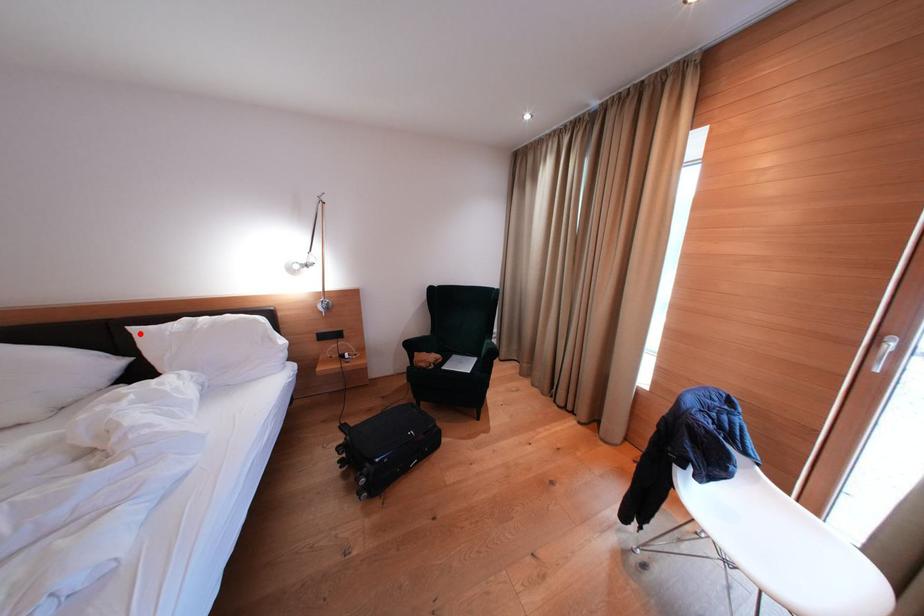
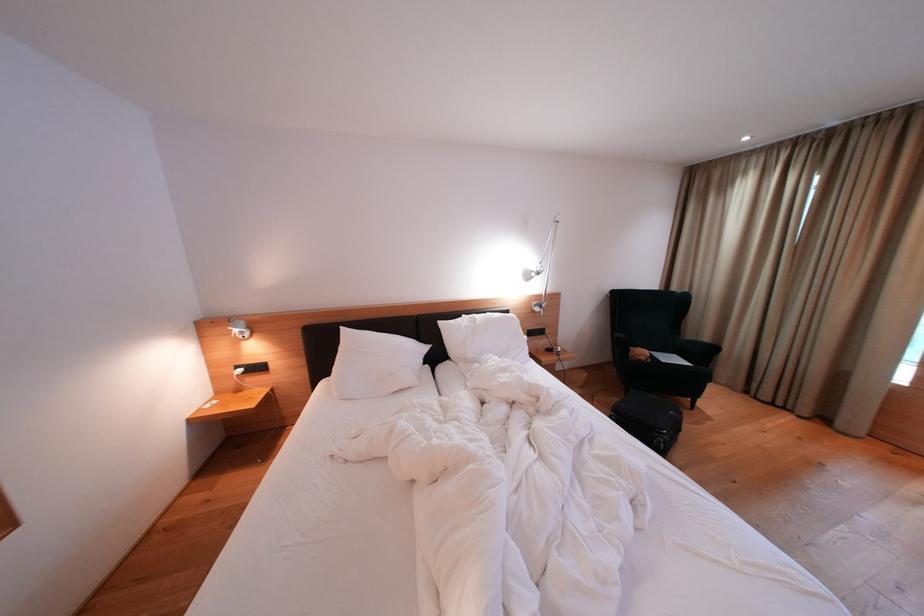
Locate, in the second image, the point that corresponds to the highlighted location in the first image.

(447, 328)